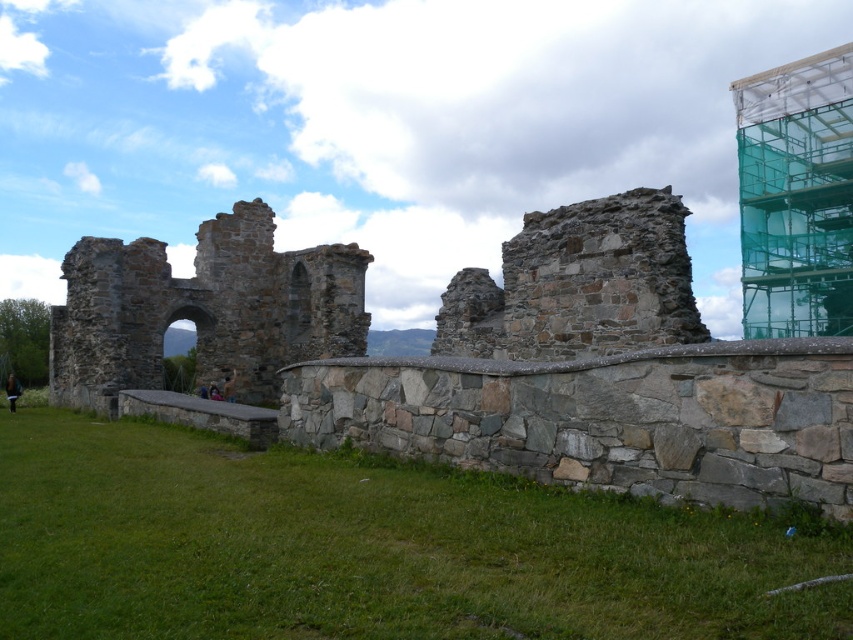
Question: Which is nearer to the stone arch at center?

Choices:
 (A) green mesh scaffolding at upper right
 (B) stone wall at center

Answer: (B)

Question: Which point is farther to the camera?

Choices:
 (A) stone arch at center
 (B) stone wall at center
 (C) green mesh scaffolding at upper right

Answer: (C)

Question: In this image, where is stone arch at center located relative to green mesh scaffolding at upper right?

Choices:
 (A) right
 (B) left

Answer: (B)

Question: Based on their relative distances, which object is nearer to the green mesh scaffolding at upper right?

Choices:
 (A) stone arch at center
 (B) stone wall at center

Answer: (B)

Question: Is stone wall at center smaller than stone arch at center?

Choices:
 (A) yes
 (B) no

Answer: (B)

Question: Can you confirm if stone wall at center is bigger than stone arch at center?

Choices:
 (A) no
 (B) yes

Answer: (B)